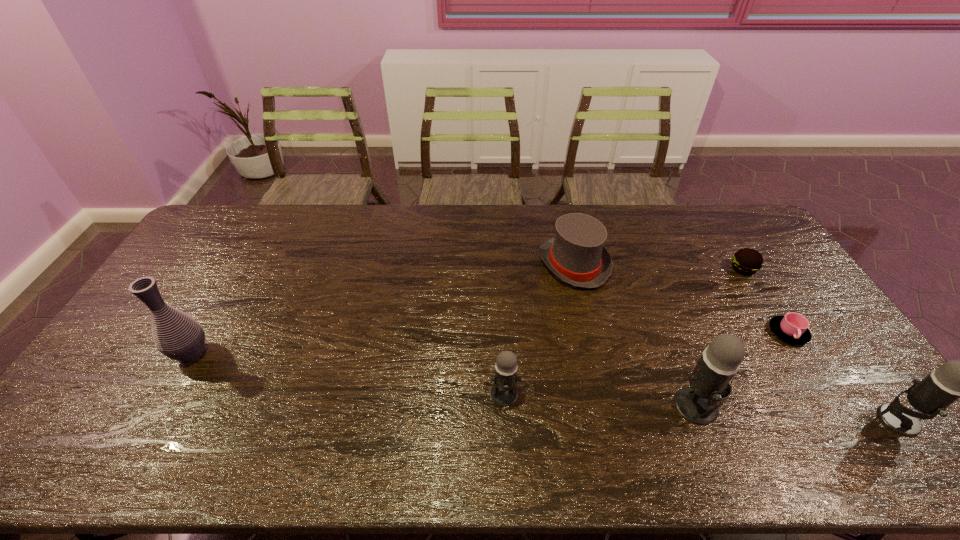
Where is `the leftmost microphone`? the leftmost microphone is located at coordinates (503, 393).

At what (x,y) coordinates should I click in order to perform the action: click on the sixth object from right to left. Please return your answer as a coordinate pair (x, y). This screenshot has height=540, width=960. Looking at the image, I should click on (503, 393).

Locate an element on the screen. The width and height of the screenshot is (960, 540). the second microphone from left to right is located at coordinates (699, 403).

Image resolution: width=960 pixels, height=540 pixels. Identify the location of the tallest microphone. (699, 403).

I want to click on the rightmost object, so click(x=955, y=379).

Where is `the rightmost microphone`? This screenshot has height=540, width=960. the rightmost microphone is located at coordinates (955, 379).

Identify the location of the fifth tallest object. This screenshot has width=960, height=540. (576, 255).

Locate an element on the screen. This screenshot has height=540, width=960. the third object from left to right is located at coordinates (576, 255).

Find the location of a particular element. the sixth tallest object is located at coordinates (747, 261).

I want to click on cup, so click(793, 327).